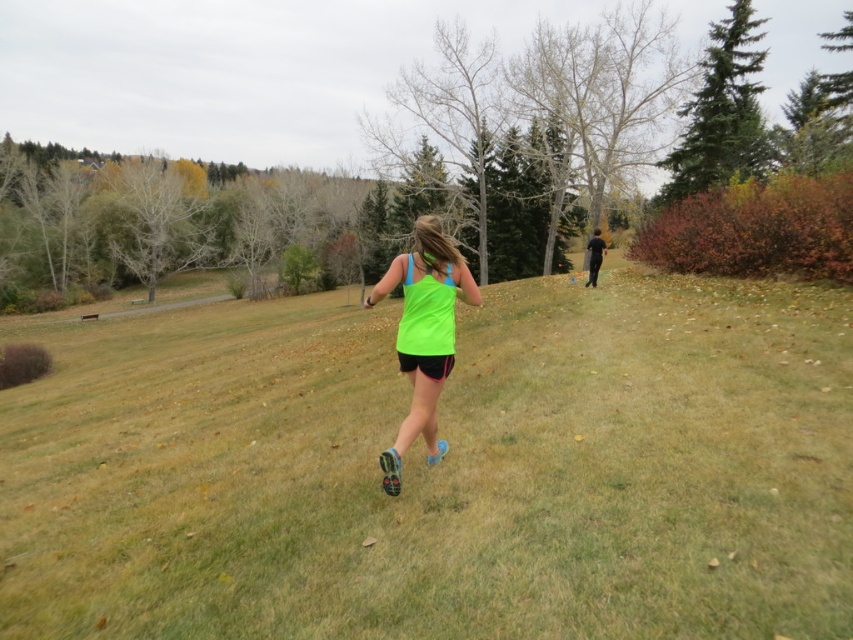
Is point (308, 385) positioned behind point (416, 432)?

Yes, point (308, 385) is behind point (416, 432).

Who is shorter, green grass at center or neon green fabric tank top at center?

With less height is neon green fabric tank top at center.

Is point (132, 368) farther from camera compared to point (416, 388)?

Yes, it is behind point (416, 388).

The width and height of the screenshot is (853, 640). What are the coordinates of `green grass at center` in the screenshot? It's located at (440, 470).